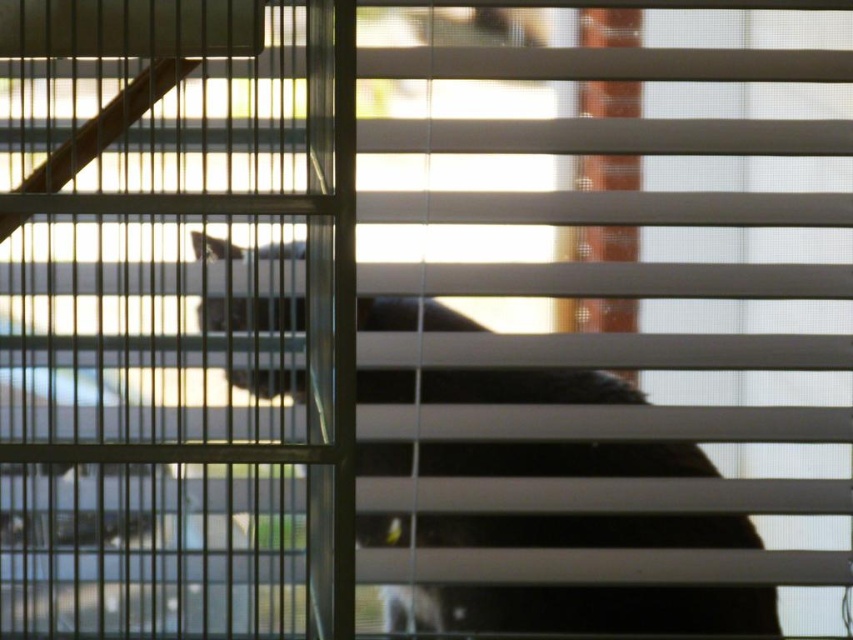
You are trying to determine if the metallic silver screen door at upper left can fit through the space where the fluffy black cat at center is currently located. Based on their sizes, is this possible?

The metallic silver screen door at upper left is smaller than the fluffy black cat at center, so it can fit through the space where the fluffy black cat at center is located.

You are trying to determine if the fluffy black cat at center can fit under the metallic silver screen door at upper left. Based on their heights, can the cat pass through without bending?

The metallic silver screen door at upper left has a greater height compared to the fluffy black cat at center, so the cat can pass through without bending.